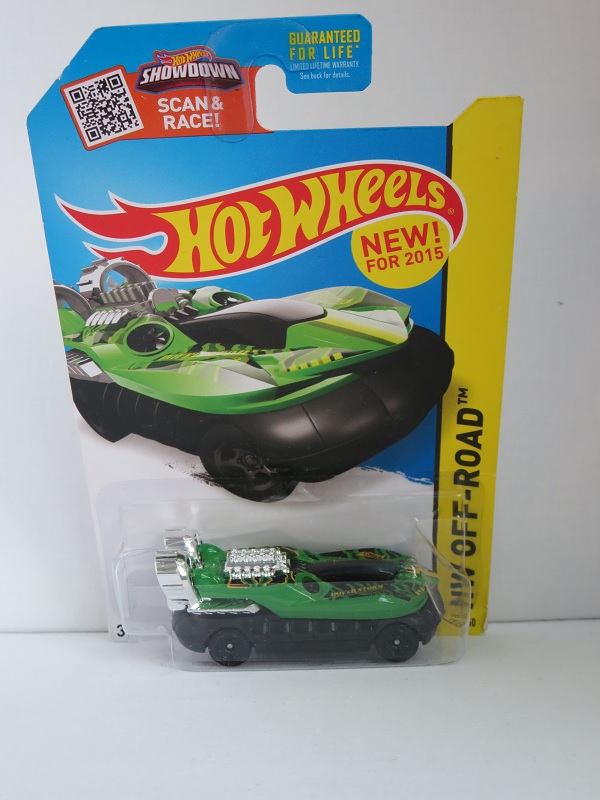
This screenshot has width=600, height=800. Identify the location of white surface. (256, 770).